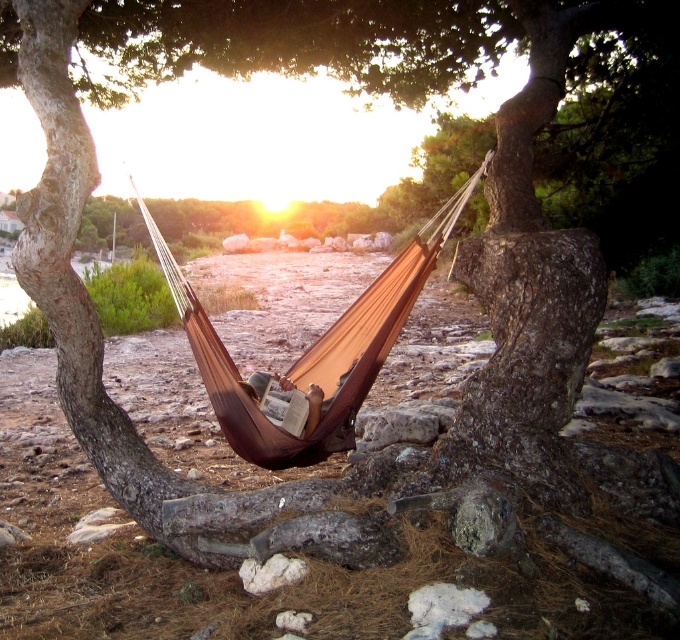
Who is shorter, brown fabric hammock at center or leather-like brown book at center?

With less height is leather-like brown book at center.

Is point (445, 225) in front of point (316, 385)?

That is True.

Between point (313, 376) and point (307, 401), which one is positioned behind?

The point (313, 376) is more distant.

Where is `brown fabric hammock at center`? brown fabric hammock at center is located at coordinates (309, 355).